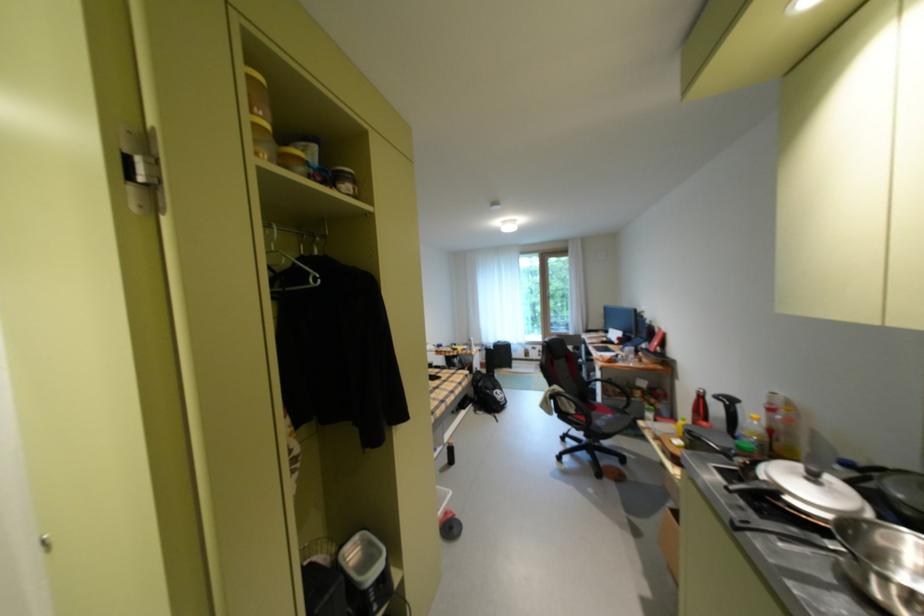
This screenshot has height=616, width=924. Identify the location of pan lid handle. (865, 598).